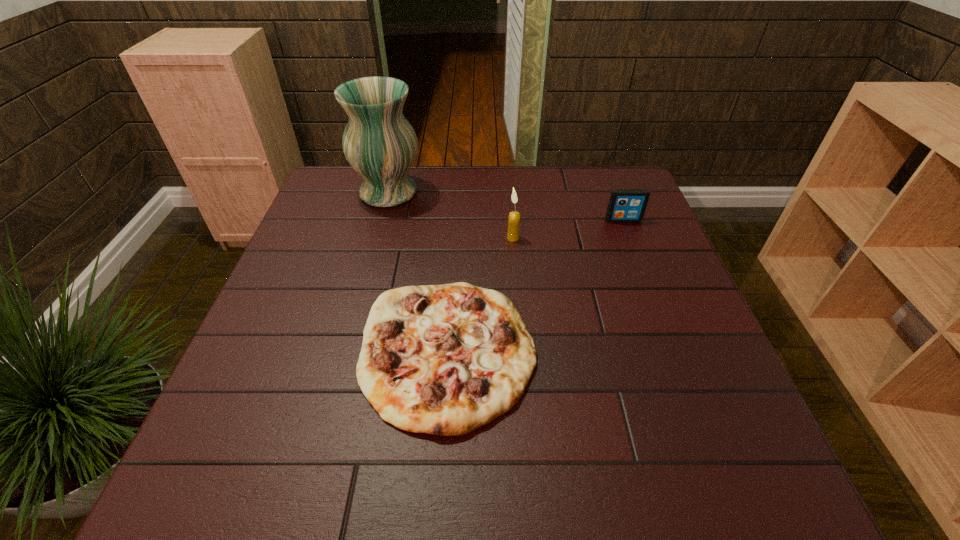
Locate an element on the screen. Image resolution: width=960 pixels, height=540 pixels. the third closest object to the nearest object is located at coordinates (625, 205).